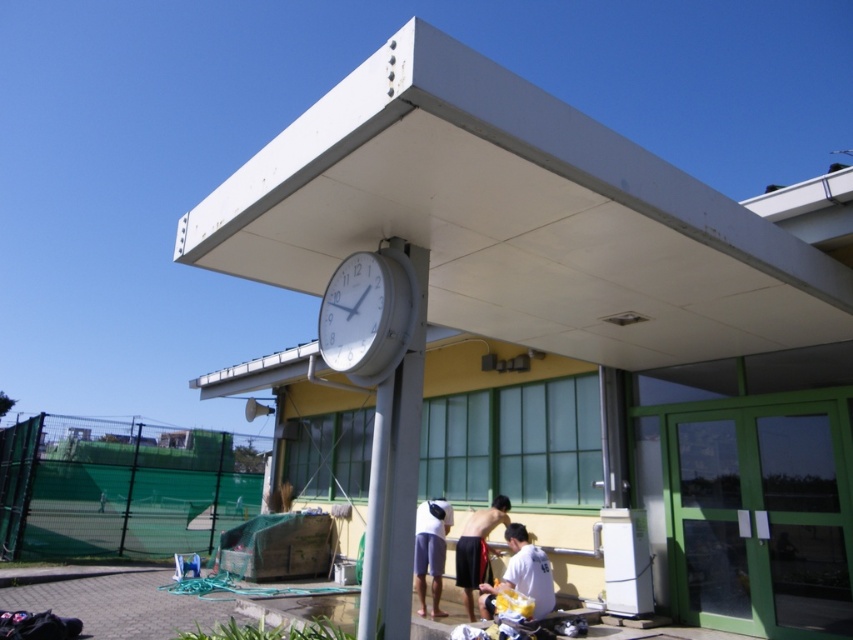
You are a photographer trying to capture a candid shot of the white matte shirt at lower center and the shiny black shorts at lower center. Since you want to focus on the details of the clothing, which clothing item should you zoom in on to ensure it takes up more space in the photo?

The white matte shirt at lower center has a larger width than the shiny black shorts at lower center, so zooming in on the white matte shirt at lower center will ensure it takes up more space in the photo.

You are standing in front of the building and notice two items at lower center. Which one is nearer to you, the white matte shirt at lower center or the shiny black shorts at lower center?

The white matte shirt at lower center is closer to the viewer than the shiny black shorts at lower center.

You are a photographer trying to capture a candid shot of the white matte shirt at lower center and the shiny black shorts at lower center. Which object should you focus on first if you want to photograph them from left to right order?

The shiny black shorts at lower center should be focused on first since the white matte shirt at lower center is positioned on the right side of it, meaning the shorts are to the left in the scene.